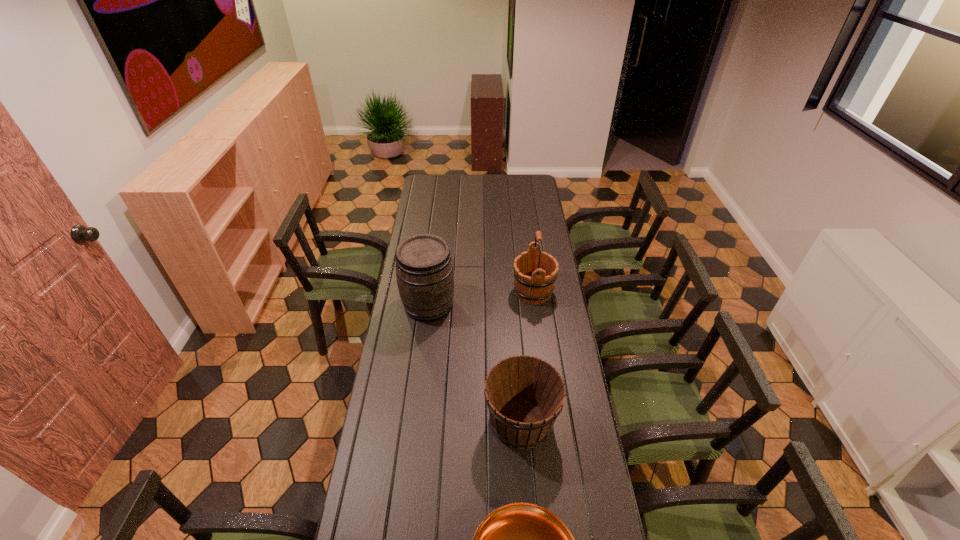
I want to click on blank space at the far right corner of the desktop, so click(x=541, y=184).

Where is `object that stands as the closest to the nearest object`? The width and height of the screenshot is (960, 540). object that stands as the closest to the nearest object is located at coordinates (524, 395).

I want to click on object that is the closest to the shortest object, so click(x=524, y=395).

I want to click on the second closest wine bucket to the shortest wine bucket, so click(x=535, y=272).

Locate which wine bucket ranks second in proximity to the shortest object. Please provide its 2D coordinates. Your answer should be formatted as a tuple, i.e. [(x, y)], where the tuple contains the x and y coordinates of a point satisfying the conditions above.

[(424, 269)]

This screenshot has width=960, height=540. Find the location of `vacant region that satisfies the following two spatial constraints: 1. on the front side of the leftmost wine bucket; 2. on the right side of the shortest wine bucket`. vacant region that satisfies the following two spatial constraints: 1. on the front side of the leftmost wine bucket; 2. on the right side of the shortest wine bucket is located at coordinates (415, 421).